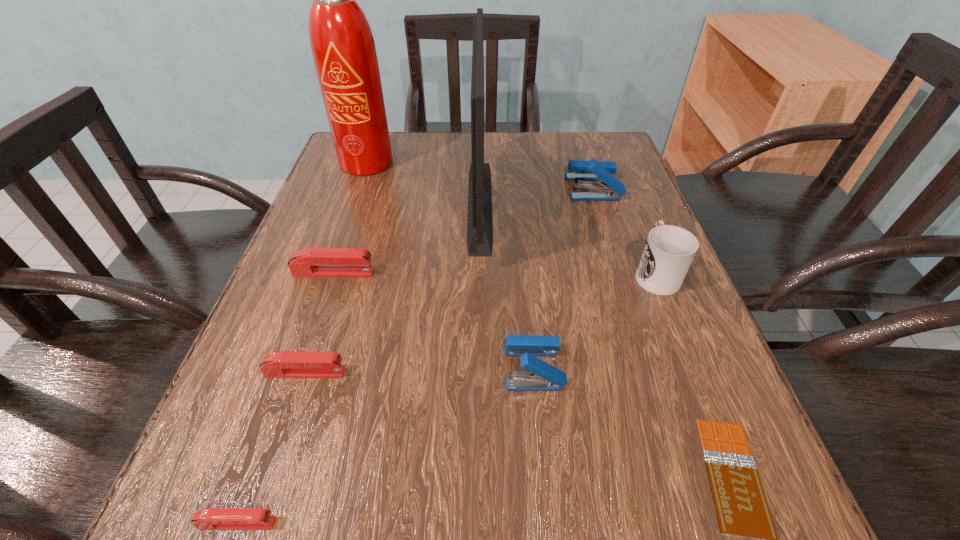
Image resolution: width=960 pixels, height=540 pixels. I want to click on the biggest red stapler, so click(311, 262).

What are the coordinates of `the second farthest red stapler` in the screenshot? It's located at (286, 364).

This screenshot has width=960, height=540. In order to click on the second biggest red stapler in this screenshot , I will do `click(286, 364)`.

Find the location of a particular element. the second shortest object is located at coordinates (213, 518).

This screenshot has height=540, width=960. I want to click on the nearest stapler, so click(x=213, y=518).

Identify the location of vacant space located 0.110m on the front of the red fire extinguisher. This screenshot has width=960, height=540. (356, 204).

Identify the location of vacant space located 0.070m on the front-facing side of the monitor. The width and height of the screenshot is (960, 540). (523, 204).

In order to click on free spot located 0.400m on the handle side of the cup in this screenshot , I will do `click(606, 150)`.

You are a GUI agent. You are given a task and a screenshot of the screen. Output one action in this format:
    pyautogui.click(x=<x>, y=<y>)
    Task: Click on the free space located on the handle side of the cup
    
    Given the screenshot: What is the action you would take?
    pyautogui.click(x=616, y=175)

Find the location of a particular element. Image resolution: width=960 pixels, height=540 pixels. vacant area situated 0.220m on the handle side of the cup is located at coordinates pos(622,189).